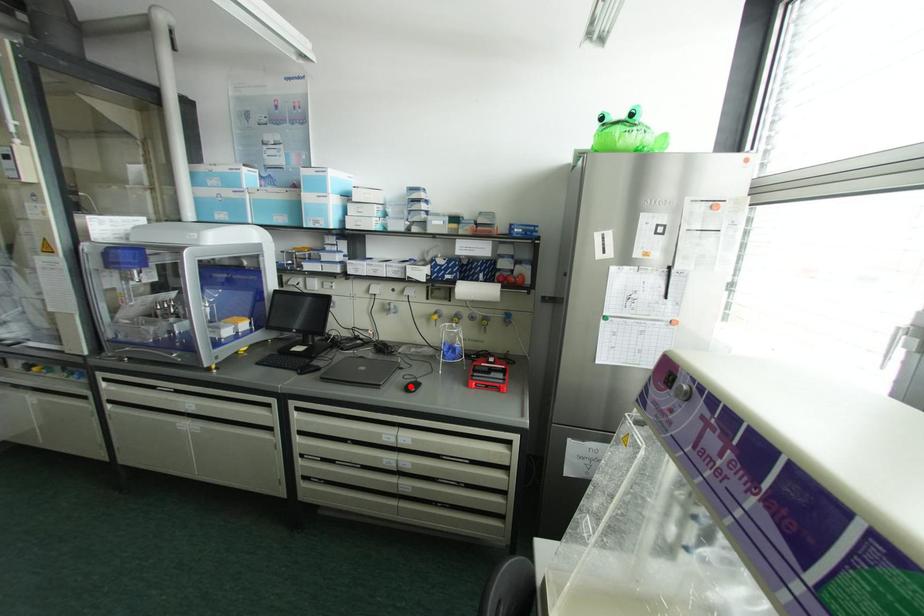
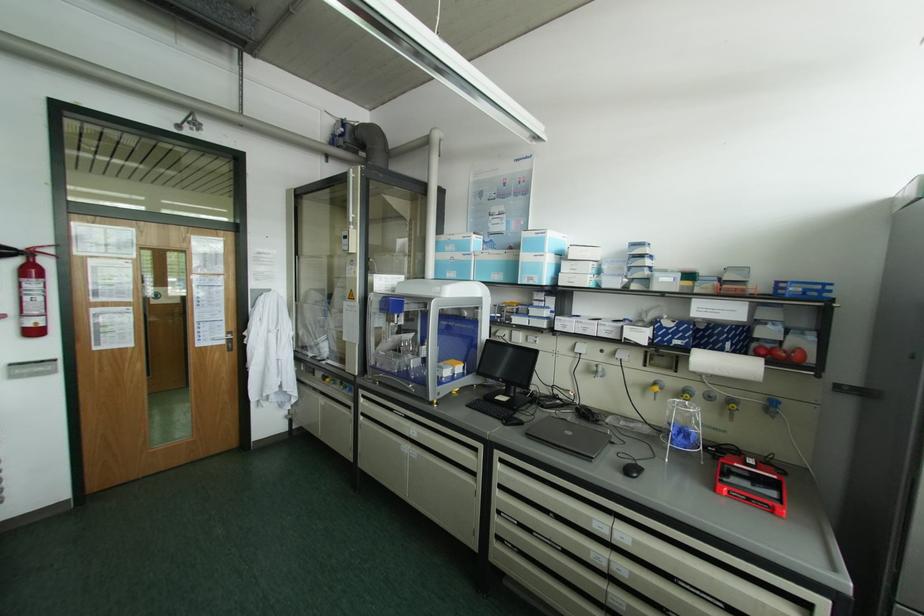
The point at the highlighted location is marked in the first image. Where is the corresponding point in the second image?

(630, 469)